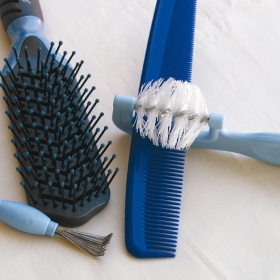
Image resolution: width=280 pixels, height=280 pixels. I want to click on white surface, so click(105, 42).